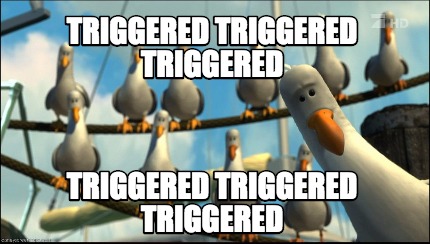
Identify the location of cable. The image size is (430, 244). (98, 81), (296, 10), (328, 9).